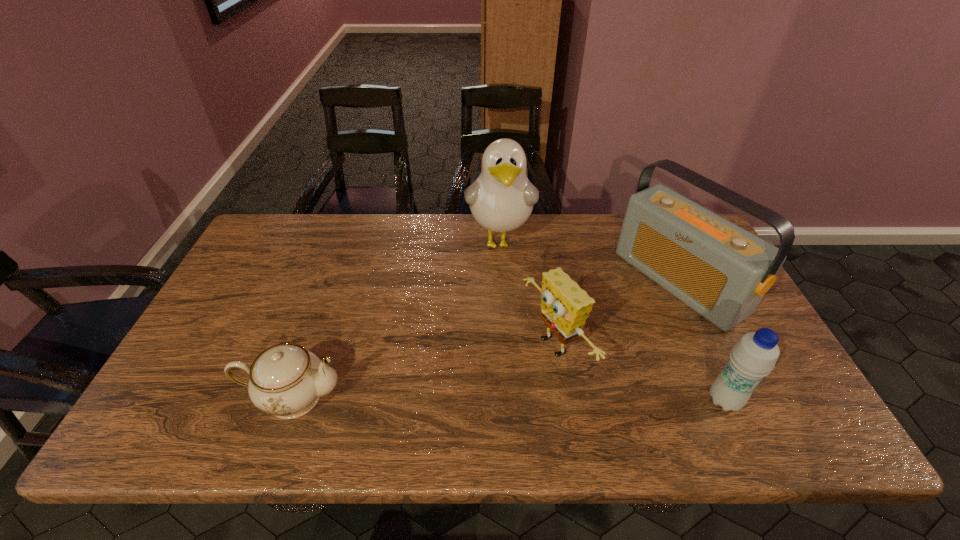
Find the location of a particular element. This screenshot has height=540, width=960. water bottle present at the right edge is located at coordinates (754, 356).

Find the location of `radio receiver that is at the right edge`. radio receiver that is at the right edge is located at coordinates (720, 270).

The height and width of the screenshot is (540, 960). Find the location of `object present at the far right corner`. object present at the far right corner is located at coordinates (720, 270).

Identify the location of object located in the near right corner section of the desktop. This screenshot has height=540, width=960. (754, 356).

Find the location of a particular element. vacant space at the far edge of the desktop is located at coordinates (360, 247).

At what (x,y) coordinates should I click in order to perform the action: click on free space at the near edge of the desktop. Please return your answer as a coordinate pair (x, y). Looking at the image, I should click on (594, 382).

Image resolution: width=960 pixels, height=540 pixels. What are the coordinates of `vacant space at the left edge` in the screenshot? It's located at (226, 312).

What are the coordinates of `vacant area at the near left corner of the desktop` in the screenshot? It's located at (208, 394).

Locate an element on the screen. The image size is (960, 540). blank region between the shortest object and the gull is located at coordinates (396, 319).

This screenshot has height=540, width=960. Identify the location of empty space between the water bottle and the gull. (612, 320).